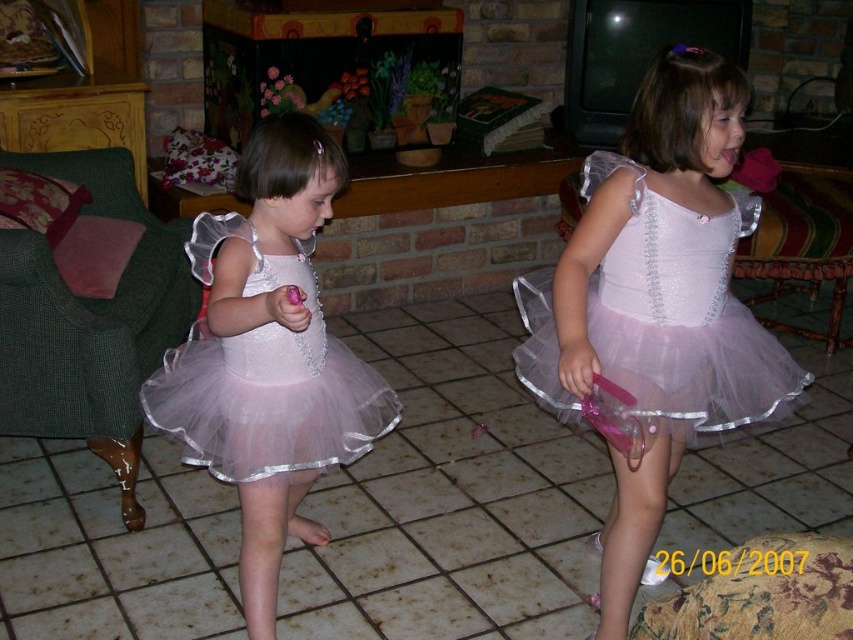
Question: Which of these objects is positioned farthest from the pink tulle dress at left?

Choices:
 (A) pink tulle dress at center
 (B) pink tulle ballet skirt at center

Answer: (A)

Question: Is pink tulle dress at left to the right of pink tulle ballet skirt at center from the viewer's perspective?

Choices:
 (A) yes
 (B) no

Answer: (B)

Question: Is pink tulle dress at left positioned before pink tulle ballet skirt at center?

Choices:
 (A) yes
 (B) no

Answer: (A)

Question: Among these points, which one is farthest from the camera?

Choices:
 (A) (520, 365)
 (B) (193, 465)
 (C) (651, 282)

Answer: (B)

Question: Which object is closer to the camera taking this photo?

Choices:
 (A) pink tulle dress at left
 (B) pink tulle ballet skirt at center

Answer: (A)

Question: Is pink tulle dress at center to the left of pink tulle dress at left from the viewer's perspective?

Choices:
 (A) yes
 (B) no

Answer: (B)